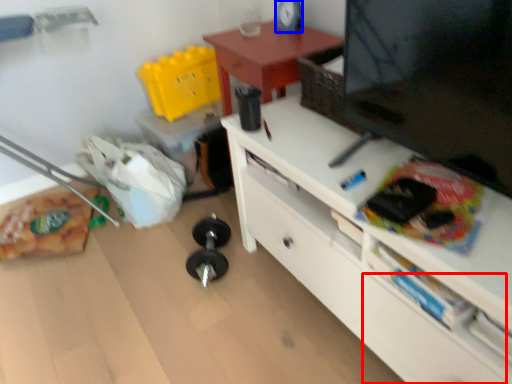
Question: Which object appears closest to the camera in this image, drawer (highlighted by a red box) or clock (highlighted by a blue box)?

Choices:
 (A) drawer
 (B) clock

Answer: (A)